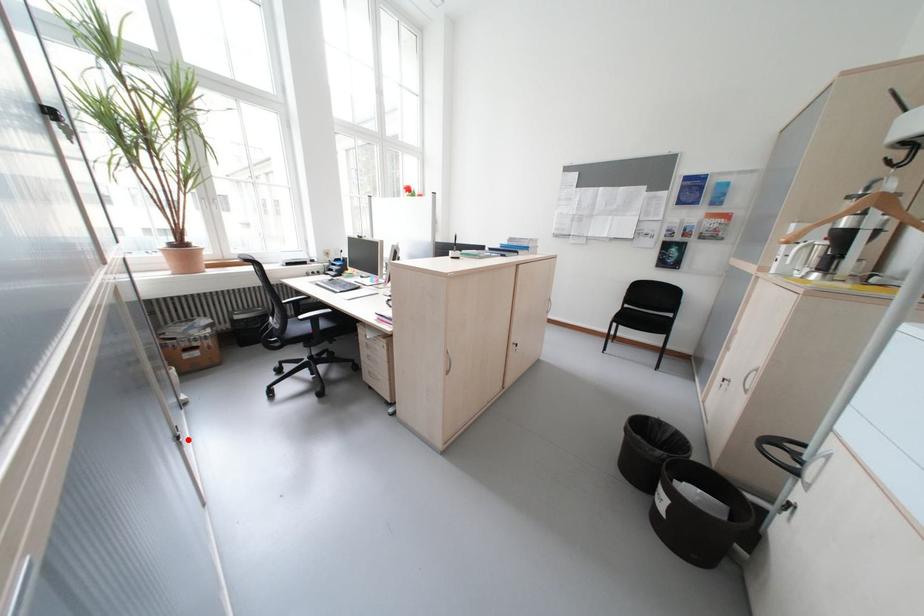
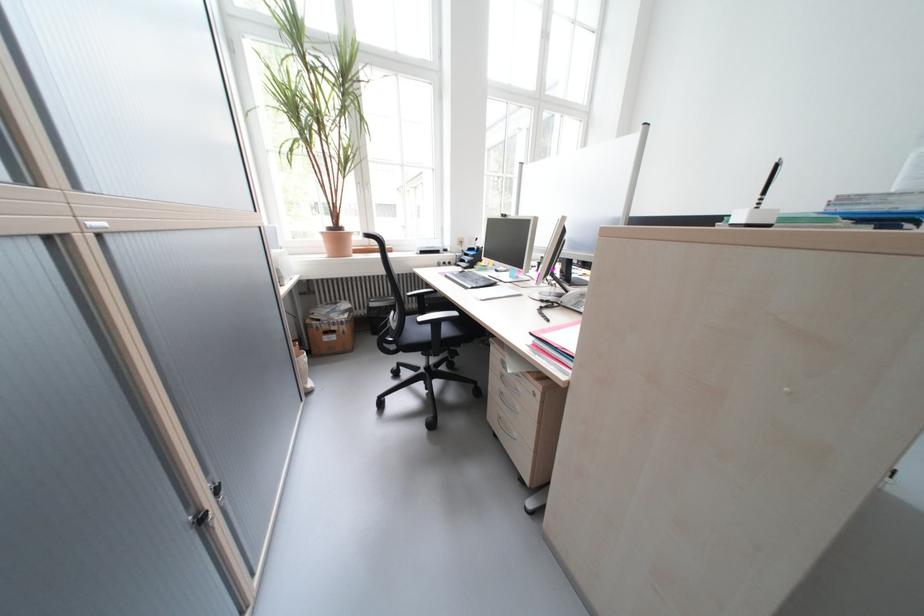
Where in the second image is the point corresponding to the highlighted location from the first image?

(213, 521)